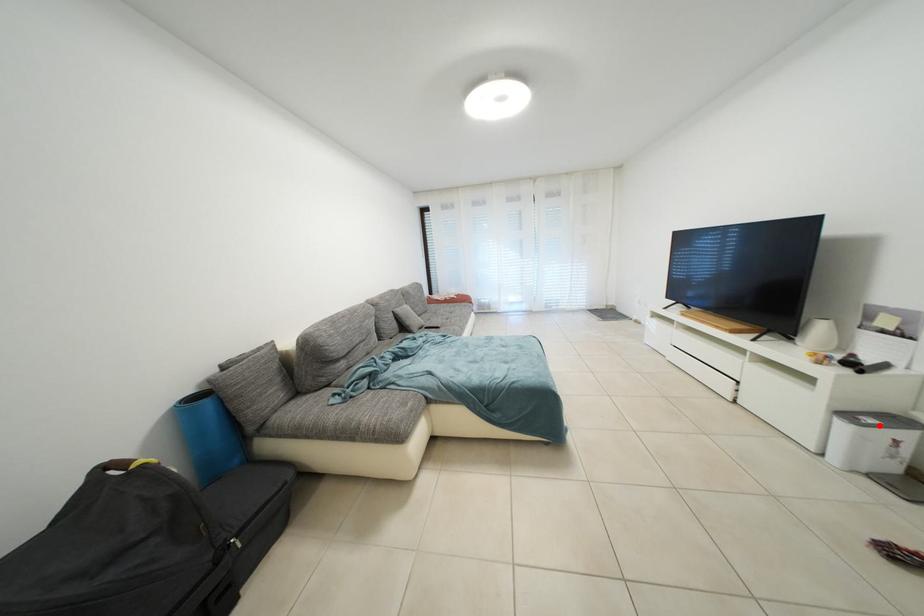
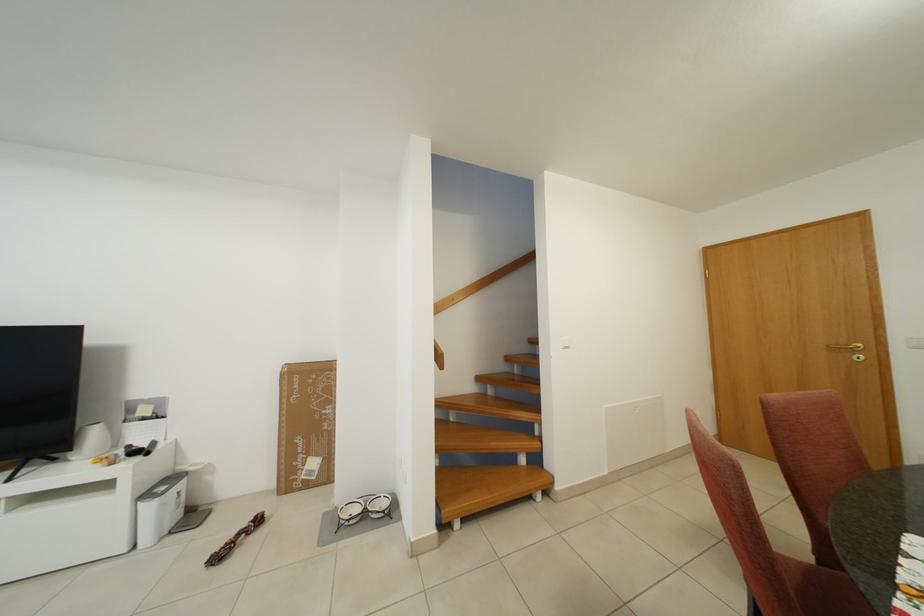
Question: I am providing you with two images of the same scene from different viewpoints. A red point is shown in image1. For the corresponding object point in image2, is it positioned nearer or farther from the camera?

Choices:
 (A) Nearer
 (B) Farther

Answer: (A)